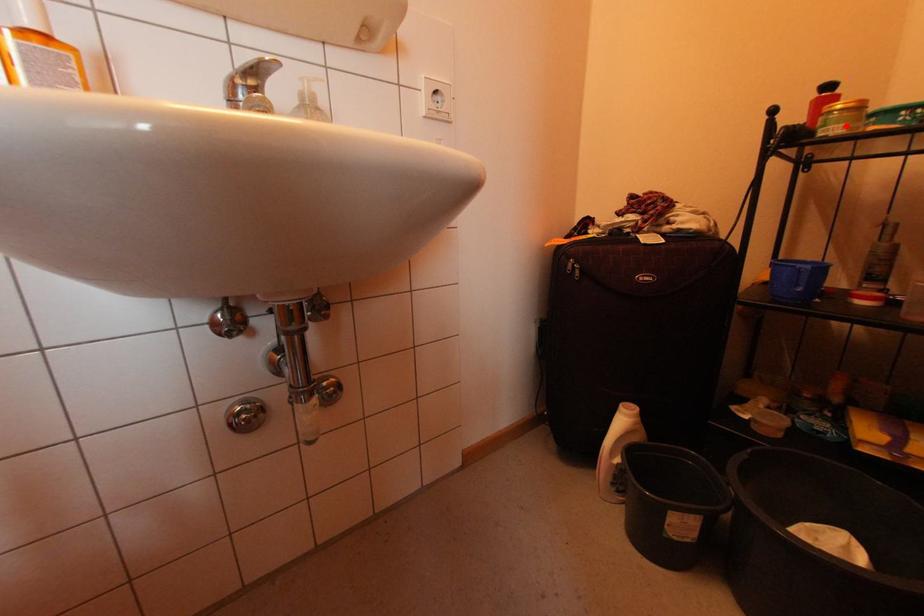
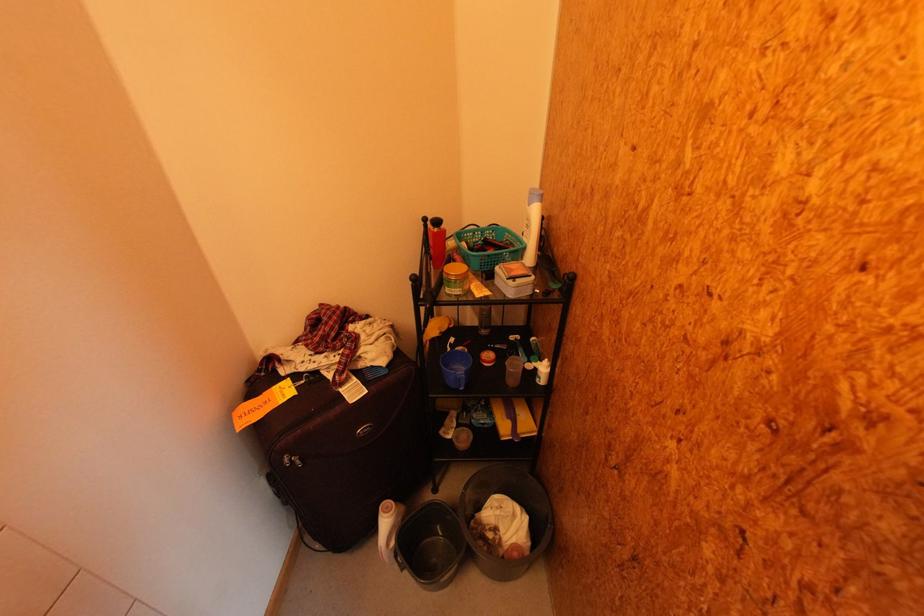
Question: A red point is marked in image1. In image2, is the corresponding 3D point closer to the camera or farther? Reply with the corresponding letter.

Choices:
 (A) The corresponding 3D point is closer.
 (B) The corresponding 3D point is farther.

Answer: (A)